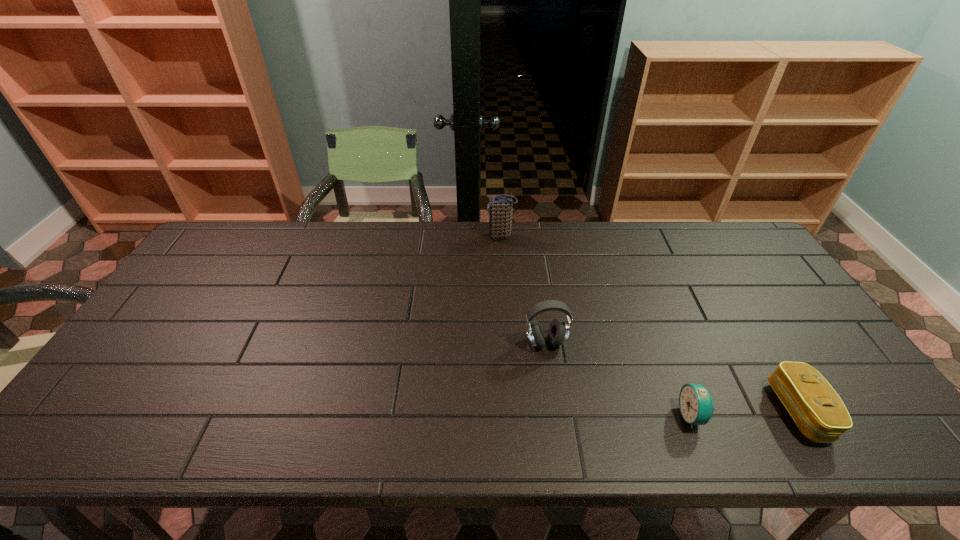
This screenshot has width=960, height=540. Find the location of `free space that is in between the rightmost object and the alarm clock`. free space that is in between the rightmost object and the alarm clock is located at coordinates (746, 413).

This screenshot has height=540, width=960. In order to click on vacant space that is in between the second farthest object and the farthest object in this screenshot , I will do `click(523, 289)`.

This screenshot has height=540, width=960. I want to click on free space that is in between the rightmost object and the second object from right to left, so click(746, 413).

Locate an element on the screen. This screenshot has height=540, width=960. vacant area that lies between the rightmost object and the alarm clock is located at coordinates (746, 413).

This screenshot has height=540, width=960. What are the coordinates of `vacant area that lies between the second farthest object and the nearer clutch bag` in the screenshot? It's located at (673, 377).

This screenshot has height=540, width=960. What are the coordinates of `empty location between the nearer clutch bag and the third object from left to right` in the screenshot? It's located at (746, 413).

Where is `free area in between the left clutch bag and the second object from right to left`? free area in between the left clutch bag and the second object from right to left is located at coordinates (596, 326).

You are a GUI agent. You are given a task and a screenshot of the screen. Output one action in this format:
    pyautogui.click(x=<x>, y=<y>)
    Task: Click on the object that stands as the third closest to the second farthest object
    
    Given the screenshot: What is the action you would take?
    pyautogui.click(x=818, y=411)

Locate which object ranks in proximity to the alarm clock. Please provide its 2D coordinates. Your answer should be formatted as a tuple, i.e. [(x, y)], where the tuple contains the x and y coordinates of a point satisfying the conditions above.

[(818, 411)]